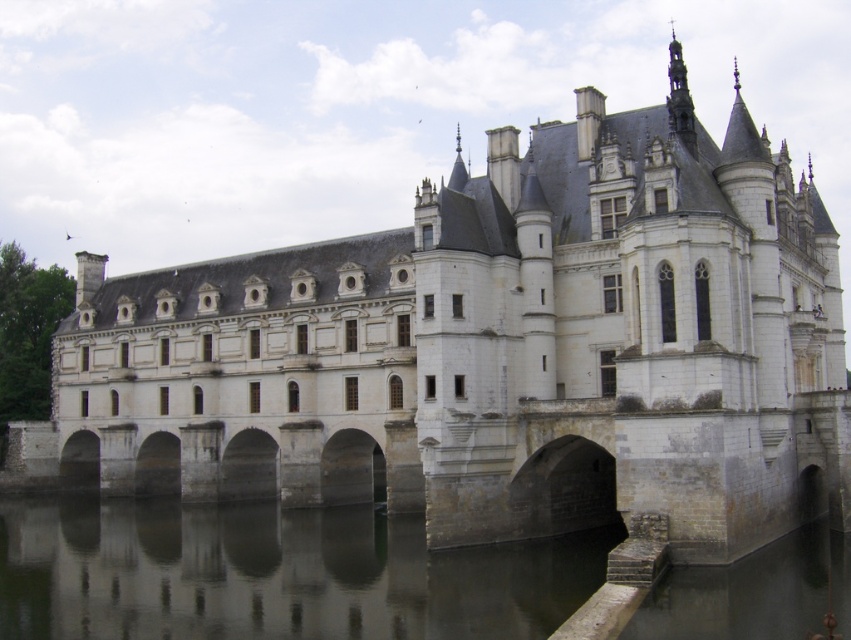
Who is higher up, smooth gray water at lower center or stone arch bridge at center?

Positioned higher is stone arch bridge at center.

What do you see at coordinates (273, 573) in the screenshot? I see `smooth gray water at lower center` at bounding box center [273, 573].

Image resolution: width=851 pixels, height=640 pixels. Find the location of `smooth gray water at lower center`. smooth gray water at lower center is located at coordinates (273, 573).